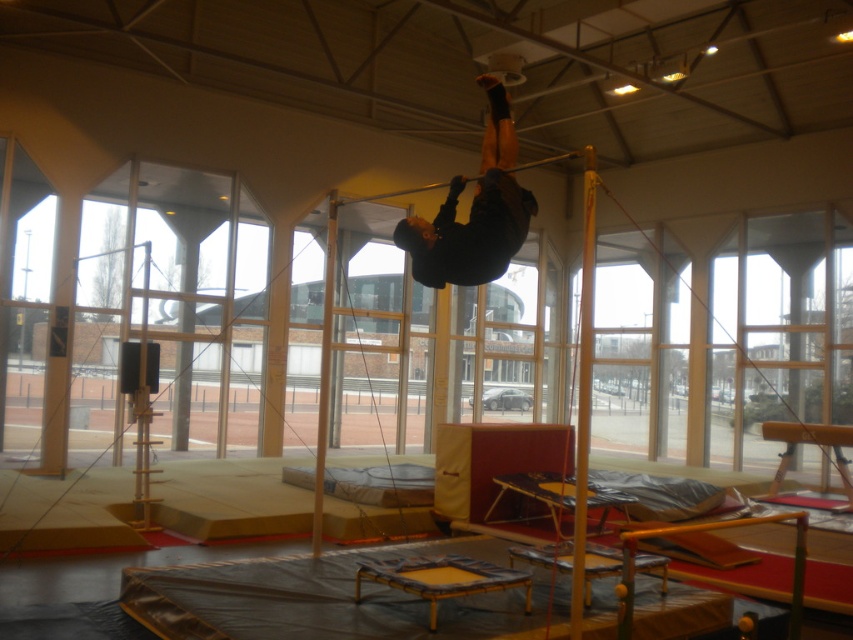
Question: Does black matte clothing at upper center appear under black rubber bar at center?

Choices:
 (A) yes
 (B) no

Answer: (A)

Question: Among these points, which one is nearest to the camera?

Choices:
 (A) (518, 170)
 (B) (485, 140)

Answer: (B)

Question: Does black matte clothing at upper center appear on the left side of black rubber bar at center?

Choices:
 (A) yes
 (B) no

Answer: (B)

Question: Which of the following is the farthest from the observer?

Choices:
 (A) black rubber bar at center
 (B) black matte clothing at upper center

Answer: (B)

Question: Can you confirm if black matte clothing at upper center is positioned to the left of black rubber bar at center?

Choices:
 (A) yes
 (B) no

Answer: (B)